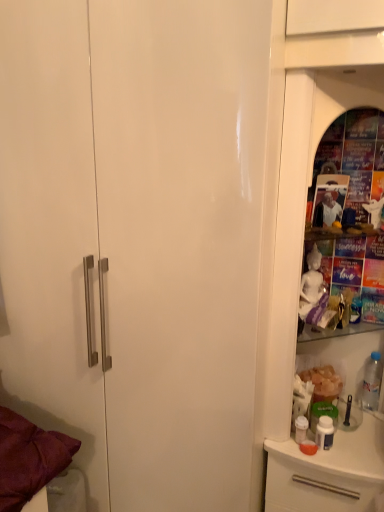
This screenshot has width=384, height=512. Find the location of `vacant region in front of translucent plastic bottle at right`. vacant region in front of translucent plastic bottle at right is located at coordinates (366, 433).